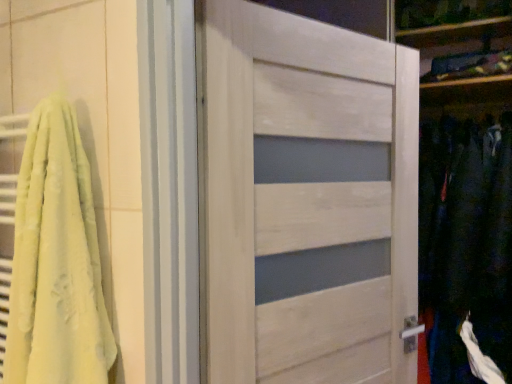
Question: Does dark blue fabric at right lie behind white wood door at center?

Choices:
 (A) yes
 (B) no

Answer: (A)

Question: Does dark blue fabric at right have a smaller size compared to white wood door at center?

Choices:
 (A) no
 (B) yes

Answer: (A)

Question: Does dark blue fabric at right come in front of white wood door at center?

Choices:
 (A) yes
 (B) no

Answer: (B)

Question: Does dark blue fabric at right have a lesser width compared to white wood door at center?

Choices:
 (A) yes
 (B) no

Answer: (B)

Question: Does dark blue fabric at right contain white wood door at center?

Choices:
 (A) no
 (B) yes

Answer: (A)

Question: Which is correct: white wood door at center is inside soft yellow towel at left, or outside of it?

Choices:
 (A) inside
 (B) outside

Answer: (B)

Question: Looking at the image, does white wood door at center seem bigger or smaller compared to soft yellow towel at left?

Choices:
 (A) big
 (B) small

Answer: (A)

Question: Would you say white wood door at center is to the left or to the right of soft yellow towel at left in the picture?

Choices:
 (A) left
 (B) right

Answer: (B)

Question: Does point (310, 336) appear closer or farther from the camera than point (86, 269)?

Choices:
 (A) closer
 (B) farther

Answer: (B)

Question: Choose the correct answer: Is white wood door at center inside dark blue fabric at right or outside it?

Choices:
 (A) outside
 (B) inside

Answer: (A)

Question: From a real-world perspective, is white wood door at center above or below dark blue fabric at right?

Choices:
 (A) below
 (B) above

Answer: (B)

Question: Considering the positions of point (249, 188) and point (441, 145), is point (249, 188) closer or farther from the camera than point (441, 145)?

Choices:
 (A) farther
 (B) closer

Answer: (B)

Question: Would you say white wood door at center is to the left or to the right of dark blue fabric at right in the picture?

Choices:
 (A) left
 (B) right

Answer: (A)

Question: Considering the positions of soft yellow towel at left and white wood door at center in the image, is soft yellow towel at left wider or thinner than white wood door at center?

Choices:
 (A) thin
 (B) wide

Answer: (B)

Question: Is soft yellow towel at left in front of or behind white wood door at center in the image?

Choices:
 (A) behind
 (B) front

Answer: (B)